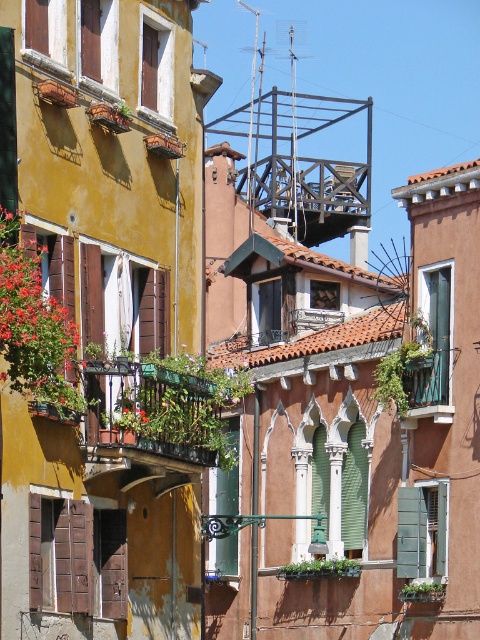
You are an architect visiting the historic town and want to compare the sizes of two architectural elements in the scene. Which one is larger between the green metal balcony at center and the brown wooden shutter at lower left?

The brown wooden shutter at lower left is larger than the green metal balcony at center.

You are standing on the street looking at two points marked in the image. The first point is at coordinate point (115, 440) and the second is at point (71, 563). Based on the scene, which point is closer to you?

Point (71, 563) is closer to you because it is in front of point (115, 440).

You are a delivery person with a cart that is 3 meters wide. You need to navigate through the narrow alley between the green metal balcony at center and the brown wooden shutter at lower left. Can your cart fit through the space between them?

The space between the green metal balcony at center and the brown wooden shutter at lower left is 2.99 meters. Since the cart is 3 meters wide, it cannot fit through the space as it is slightly narrower than the cart.